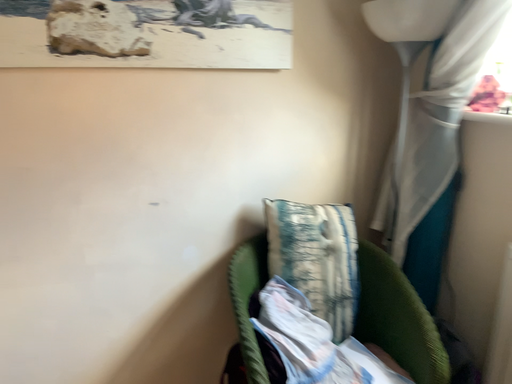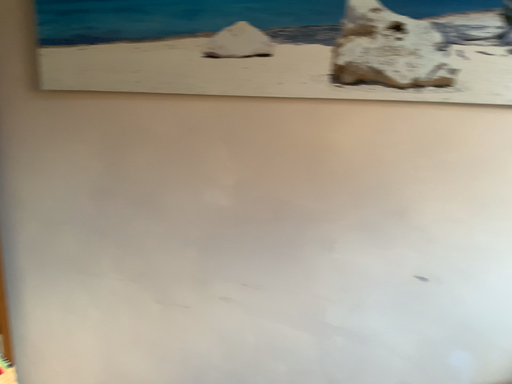
Question: Which way did the camera rotate in the video?

Choices:
 (A) rotated upward
 (B) rotated downward

Answer: (A)